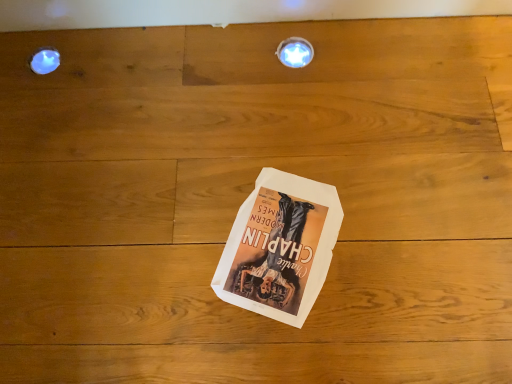
Question: Can you confirm if matte white droplight at upper left is thinner than metallic circular light fixture at upper center?

Choices:
 (A) no
 (B) yes

Answer: (B)

Question: Does matte white droplight at upper left have a greater height compared to metallic circular light fixture at upper center?

Choices:
 (A) yes
 (B) no

Answer: (B)

Question: From the image's perspective, is matte white droplight at upper left above metallic circular light fixture at upper center?

Choices:
 (A) no
 (B) yes

Answer: (A)

Question: From the image's perspective, is matte white droplight at upper left under metallic circular light fixture at upper center?

Choices:
 (A) no
 (B) yes

Answer: (B)

Question: Is matte white droplight at upper left oriented away from metallic circular light fixture at upper center?

Choices:
 (A) yes
 (B) no

Answer: (B)

Question: Is matte white droplight at upper left to the left of metallic circular light fixture at upper center from the viewer's perspective?

Choices:
 (A) yes
 (B) no

Answer: (A)

Question: From the image's perspective, is metallic circular light fixture at upper center on white paper at center?

Choices:
 (A) yes
 (B) no

Answer: (A)

Question: Is metallic circular light fixture at upper center in front of white paper at center?

Choices:
 (A) yes
 (B) no

Answer: (B)

Question: Is metallic circular light fixture at upper center positioned beyond the bounds of white paper at center?

Choices:
 (A) yes
 (B) no

Answer: (A)

Question: Is metallic circular light fixture at upper center to the left of white paper at center from the viewer's perspective?

Choices:
 (A) no
 (B) yes

Answer: (A)

Question: Is white paper at center at the back of metallic circular light fixture at upper center?

Choices:
 (A) yes
 (B) no

Answer: (B)

Question: Would you consider metallic circular light fixture at upper center to be distant from white paper at center?

Choices:
 (A) yes
 (B) no

Answer: (B)

Question: Considering the relative positions of matte white droplight at upper left and white paper at center in the image provided, is matte white droplight at upper left to the left of white paper at center from the viewer's perspective?

Choices:
 (A) yes
 (B) no

Answer: (A)